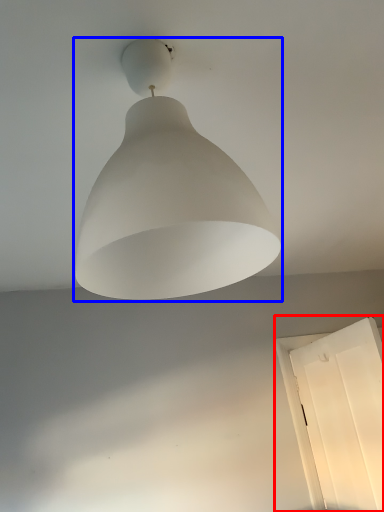
Question: Which object is further to the camera taking this photo, window (highlighted by a red box) or lamp (highlighted by a blue box)?

Choices:
 (A) window
 (B) lamp

Answer: (A)